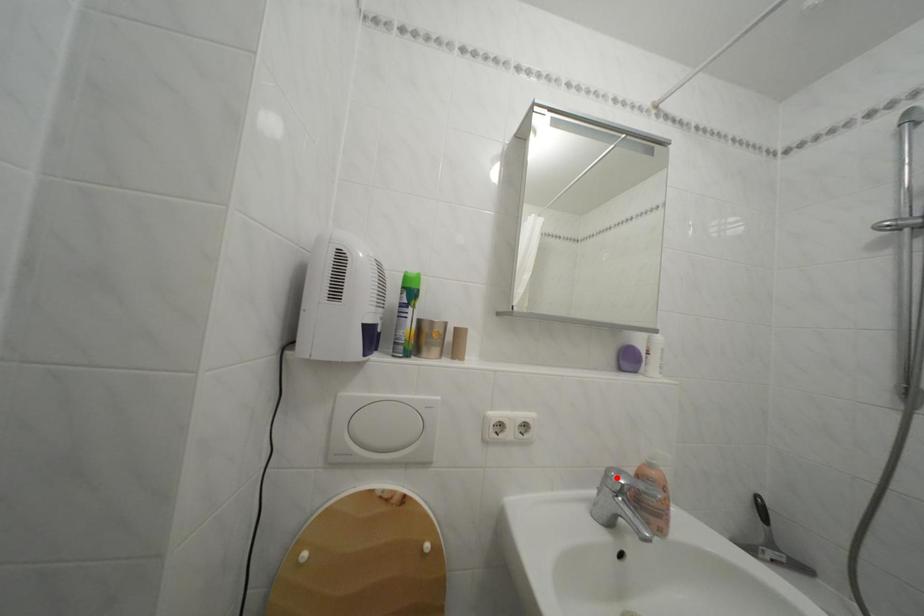
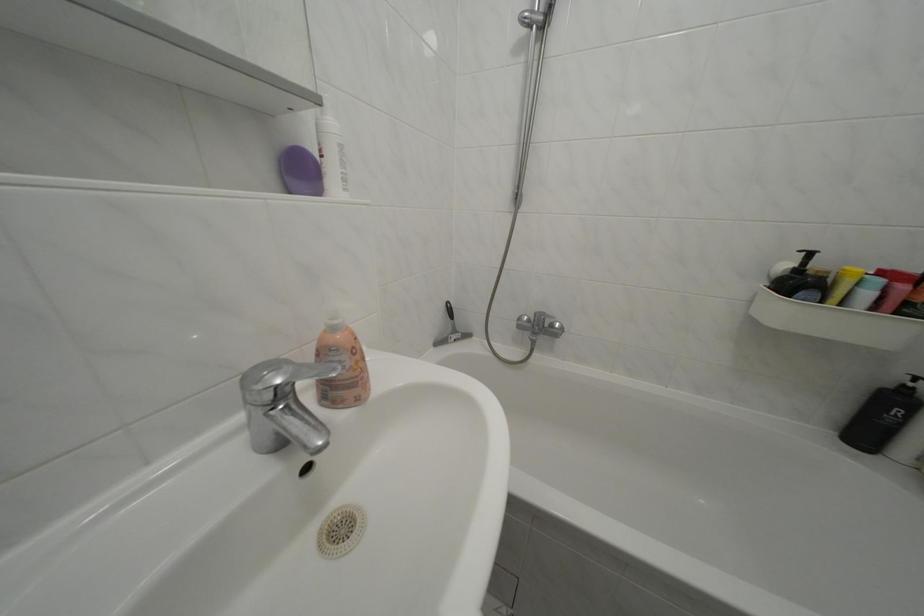
Where in the second image is the point corresponding to the highlighted location from the first image?

(252, 384)